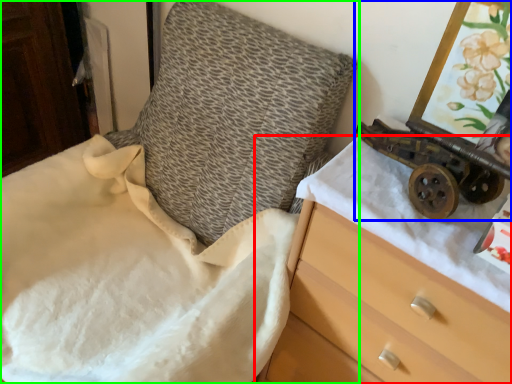
Question: Based on their relative distances, which object is farther from chest of drawers (highlighted by a red box)? Choose from toy (highlighted by a blue box) and furniture (highlighted by a green box).

Choices:
 (A) toy
 (B) furniture

Answer: (B)